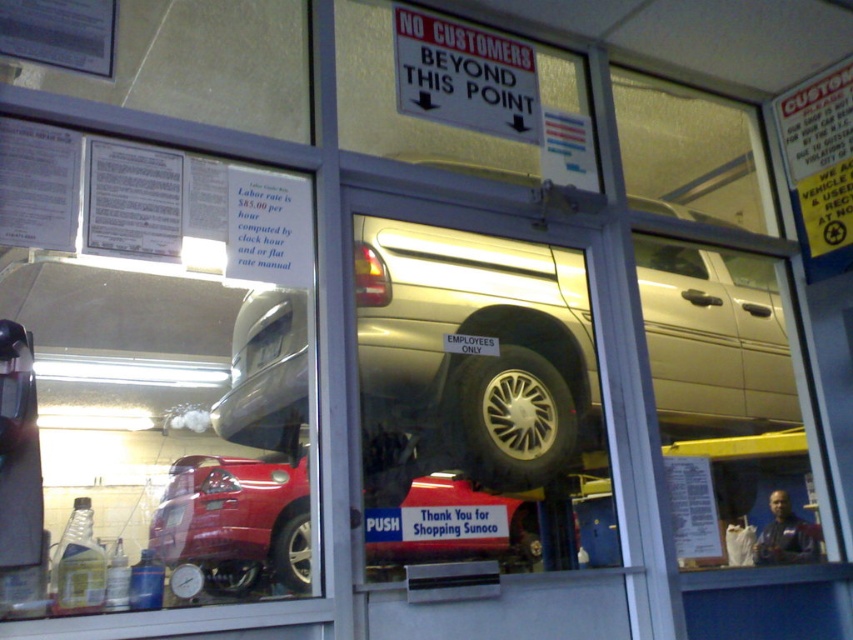
Measure the distance from black rubber tire at lower left to black rubber tire at lower center.

black rubber tire at lower left is 10.47 centimeters from black rubber tire at lower center.

Is point (300, 586) more distant than point (228, 588)?

Yes, point (300, 586) is behind point (228, 588).

The height and width of the screenshot is (640, 853). What are the coordinates of `black rubber tire at lower left` in the screenshot? It's located at (292, 552).

Is point (561, 272) closer to camera compared to point (495, 358)?

No, it is behind (495, 358).

I want to click on silver metallic truck at center, so click(x=479, y=336).

At what (x,y) coordinates should I click in order to perform the action: click on silver metallic truck at center. Please return your answer as a coordinate pair (x, y). Looking at the image, I should click on (479, 336).

Who is higher up, shiny red car at center or black rubber tire at lower center?

shiny red car at center

Who is positioned more to the left, shiny red car at center or black rubber tire at lower center?

black rubber tire at lower center

The height and width of the screenshot is (640, 853). I want to click on shiny red car at center, so click(236, 515).